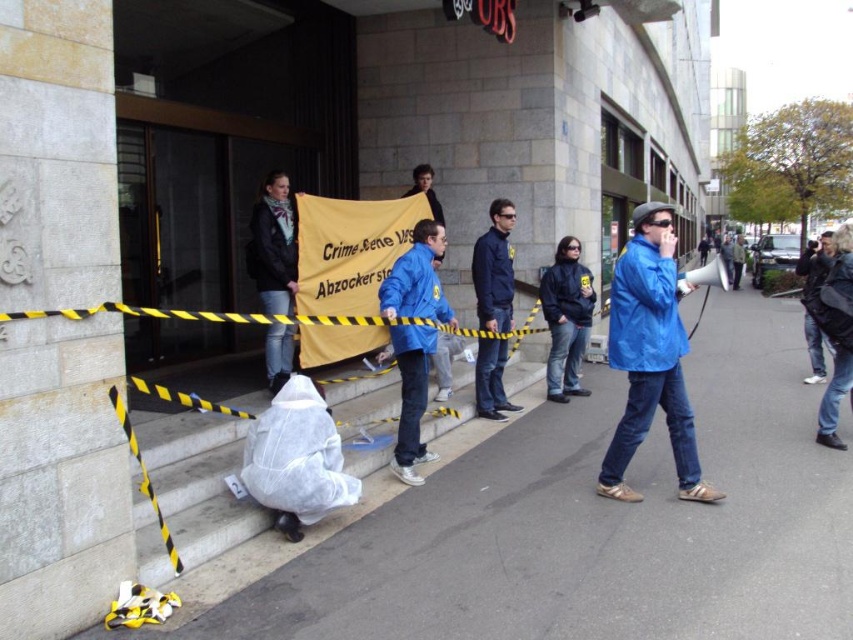
You are a delivery person trying to leave a white plastic bag at lower center at point [200,481]. The building has a yellow caution tape across the entrance. Can you safely place the bag at the specified point without crossing the caution tape?

The white plastic bag at lower center is located at point [200,481]. Since the caution tape is stretched across the entrance, you can safely place the bag at the specified point without crossing the tape as long as the placement area is outside the restricted zone marked by the tape.

You are a photographer trying to capture the entire protest scene. You notice two points marked in the image. Which point is closer to the camera? The points are point 1 at coordinates point (358, 422) and point 2 at coordinates point (477, 358).

Point 1 at coordinates point (358, 422) is closer to the camera because it is in front of point 2 at coordinates point (477, 358).